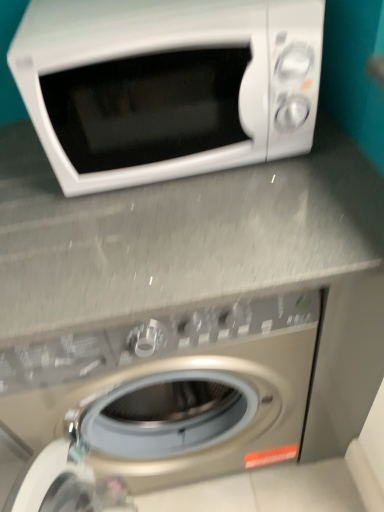
Identify the location of vacant space in front of white glossy microwave at upper center. (188, 229).